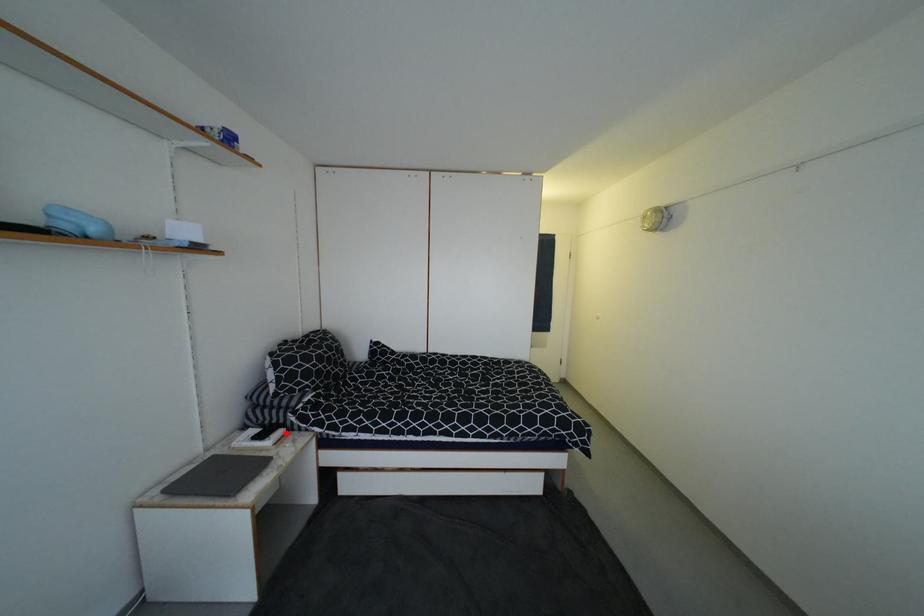
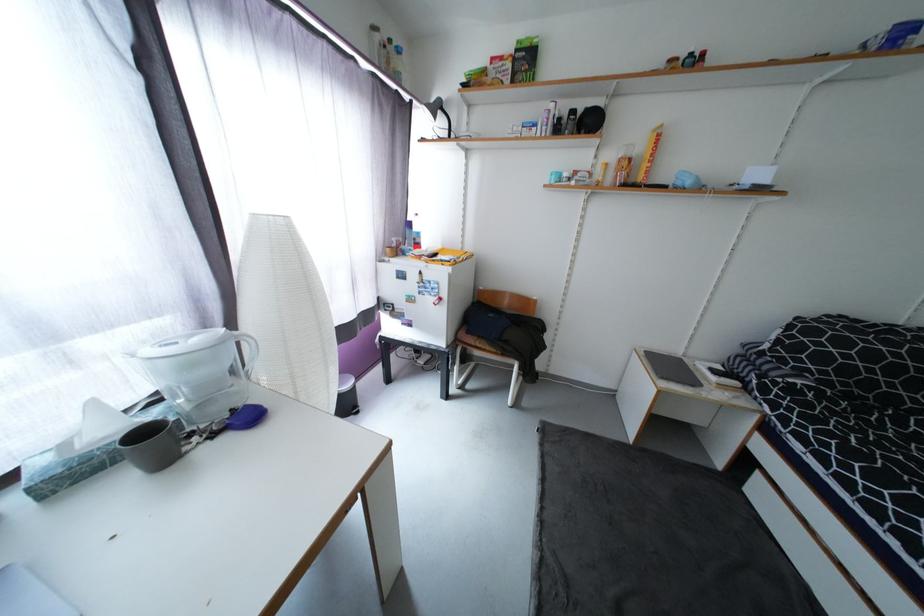
Question: I am providing you with two images of the same scene from different viewpoints. Given a red point in image1, look at the same physical point in image2. Is it:

Choices:
 (A) Closer to the viewpoint
 (B) Farther from the viewpoint

Answer: (A)